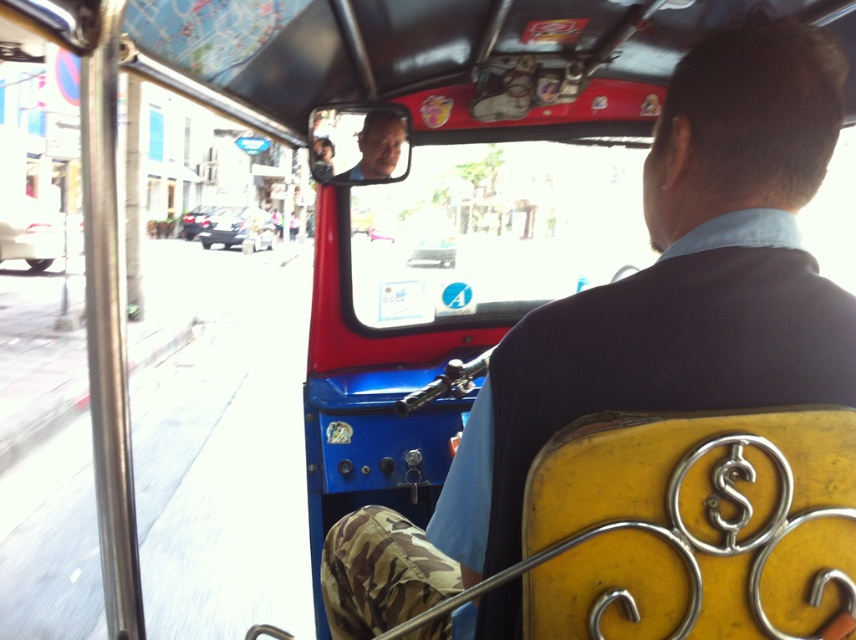
You are a passenger in the tuk tuk and want to hand a map to the driver. The map is on the floor between you and the driver. Which object, the matte black vest at center or the matte black face at center, is closer to you when you reach forward to pick up the map?

The matte black vest at center is closer to you than the matte black face at center, so you would first touch the matte black vest at center when reaching forward.

You are a passenger in a tuk tuk and want to know if the matte black face at center is above or below the metallic silver car at left. Based on the scene, what is the relationship between their positions?

The matte black face at center is located below the metallic silver car at left.

You are a passenger in a tuk tuk and want to place a small backpack on the seat in front of you. The seat has a decorative dollar sign. The point where you want to place the backpack is at coordinates point (429, 534). If the backpack requires 3 feet of space from the camera to be safely placed, can you place it there?

The distance of point (429, 534) from camera is 3.29 feet, which is more than the required 3 feet. Therefore, you can safely place the backpack there.